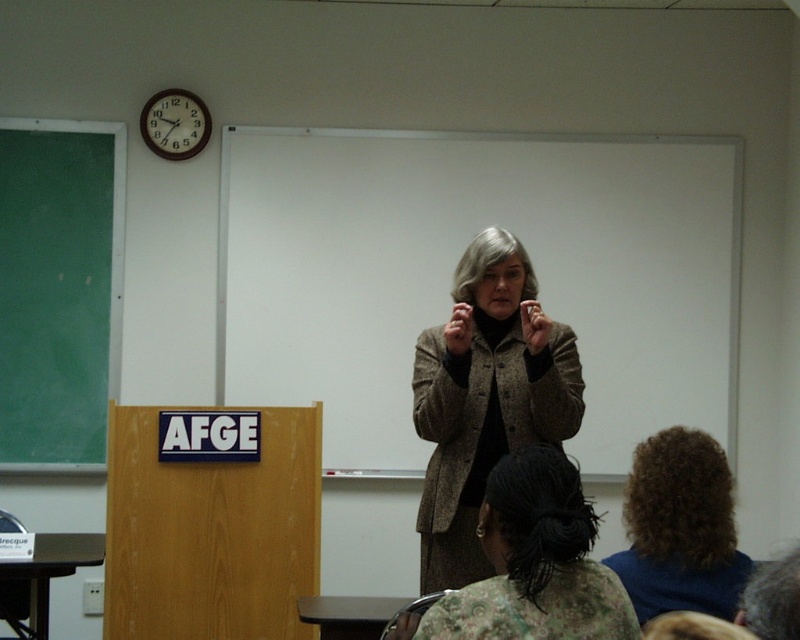
Question: Which object appears closest to the camera in this image?

Choices:
 (A) curly brown hair at lower right
 (B) wooden clock at upper left

Answer: (A)

Question: Is curly brown hair at lower right positioned behind wooden clock at upper left?

Choices:
 (A) no
 (B) yes

Answer: (A)

Question: Can you confirm if white matte board at center is positioned to the left of gray matte wig at center?

Choices:
 (A) no
 (B) yes

Answer: (A)

Question: Which of these objects is positioned farthest from the brown woolen coat at center?

Choices:
 (A) gray matte wig at center
 (B) curly brown hair at lower right

Answer: (B)

Question: Which is farther from the gray matte wig at center?

Choices:
 (A) brown woolen coat at center
 (B) dark brown hair at center

Answer: (B)

Question: Can you confirm if dark brown hair at center is wider than curly brown hair at lower right?

Choices:
 (A) yes
 (B) no

Answer: (A)